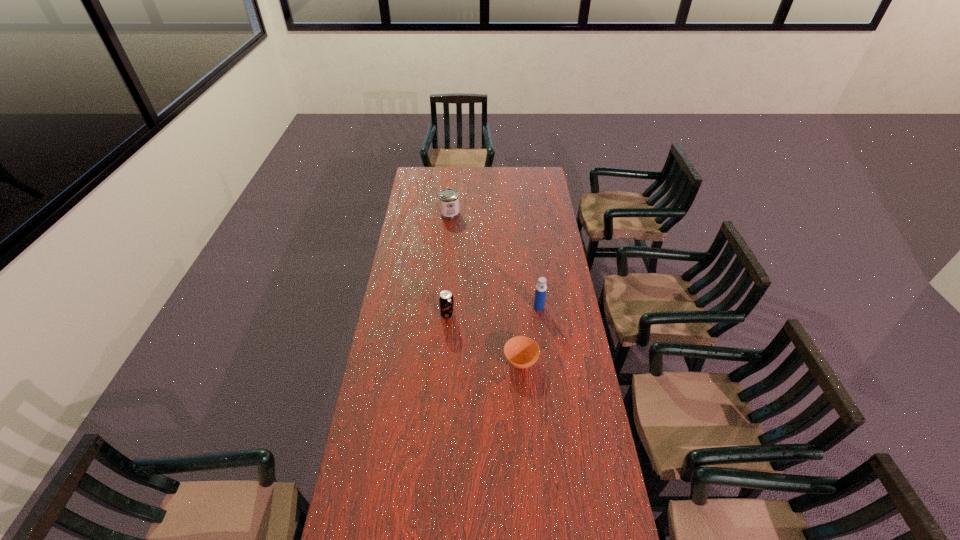
Locate an element on the screen. This screenshot has height=540, width=960. object that is at the right edge is located at coordinates (541, 288).

Identify the location of free space at the far edge of the desktop. (465, 182).

This screenshot has height=540, width=960. Identify the location of vacant space at the left edge. (392, 411).

Locate an element on the screen. vacant space at the right edge of the desktop is located at coordinates (587, 363).

Where is `free region at the far right corner of the desktop`? The height and width of the screenshot is (540, 960). free region at the far right corner of the desktop is located at coordinates (526, 174).

The image size is (960, 540). In order to click on unoccupied position between the nearest object and the can in this screenshot , I will do pos(485,287).

The height and width of the screenshot is (540, 960). Find the location of `vacant area that lies between the shortest object and the farthest object`. vacant area that lies between the shortest object and the farthest object is located at coordinates (485, 287).

I want to click on empty space that is in between the soup bowl and the soda can, so click(x=484, y=338).

This screenshot has height=540, width=960. Find the location of `free space between the soda can and the water bottle`. free space between the soda can and the water bottle is located at coordinates (493, 311).

Where is `vacant area between the soup bowl and the tallest object`? The height and width of the screenshot is (540, 960). vacant area between the soup bowl and the tallest object is located at coordinates (530, 334).